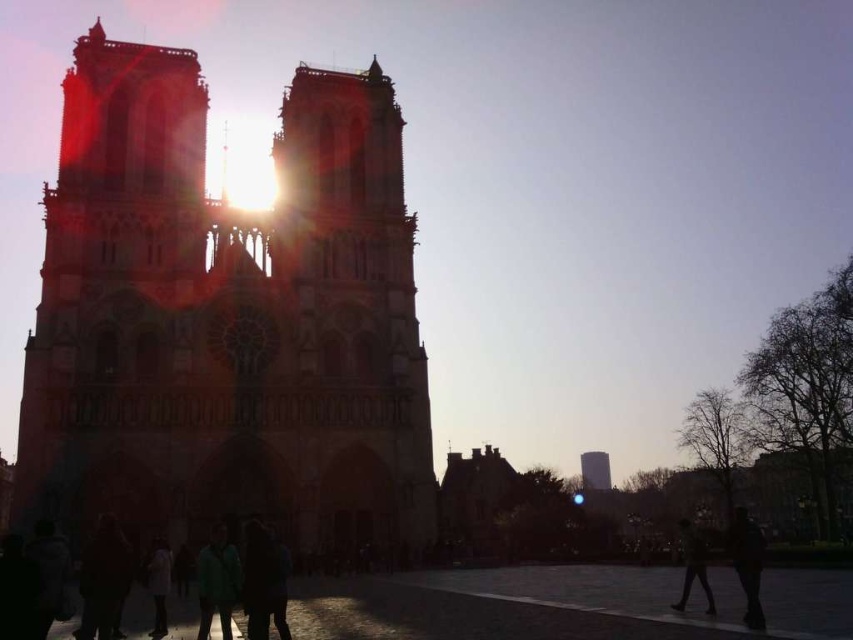
Can you confirm if green matte jacket at lower center is positioned above smooth concrete tower at center?

No.

Between point (202, 580) and point (595, 476), which one is positioned behind?

Positioned behind is point (595, 476).

Describe the element at coordinates (218, 580) in the screenshot. I see `green matte jacket at lower center` at that location.

I want to click on green matte jacket at lower center, so click(x=218, y=580).

Is point (134, 410) positioned behind point (581, 474)?

No, (134, 410) is closer to viewer.

Which is more to the right, silhouette stone tower at center or smooth concrete tower at center?

Positioned to the right is smooth concrete tower at center.

Which is in front, point (347, 193) or point (585, 467)?

Point (347, 193) is in front.

The image size is (853, 640). In order to click on silhouette stone tower at center in this screenshot , I will do `click(227, 317)`.

How much distance is there between silhouette figure at lower right and white matte jacket at lower center?

66.56 meters

Is silhouette figure at lower right above white matte jacket at lower center?

Indeed, silhouette figure at lower right is positioned over white matte jacket at lower center.

The image size is (853, 640). Describe the element at coordinates (747, 563) in the screenshot. I see `silhouette figure at lower right` at that location.

Locate an element on the screen. The image size is (853, 640). silhouette figure at lower right is located at coordinates (747, 563).